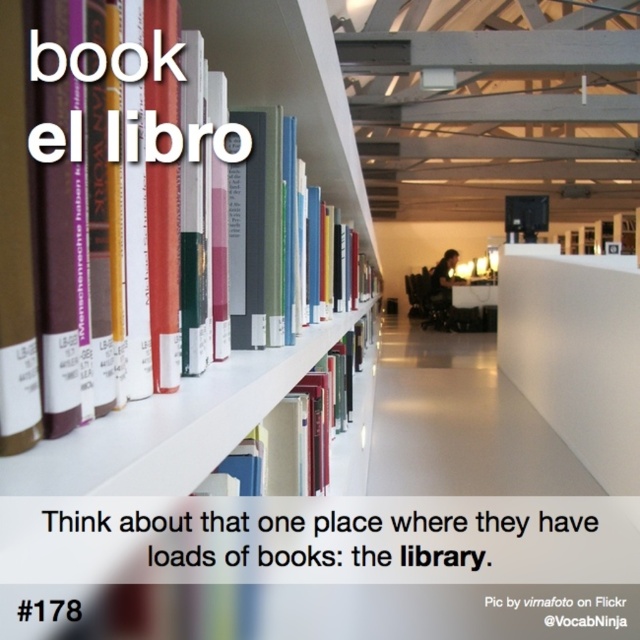
You are organizing books in a library and need to place two books on a shelf. You have the hardcover books at left and the hardcover book at center. According to their positions in the image, which one should be placed to the right of the other to maintain the same arrangement?

The hardcover books at left should be placed to the right of the hardcover book at center to maintain the same arrangement, as in the image the hardcover books at left is positioned on the right side of hardcover book at center.

You are a librarian who needs to reach the hardcover books at left to reshelve a book. If your arm can extend 50 centimeters, can you reach them without moving your position?

The hardcover books at left are 60.43 centimeters away from you. Since your arm can only extend 50 centimeters, you cannot reach them without moving your position.

You are a librarian organizing books in a modern library. You need to place a new book on the shelf. The existing hardcover books at left are located at point 0.134, 0.455. Where should you place the new book to maintain the existing arrangement?

The new book should be placed near the existing hardcover books at left at point (291, 84) to maintain the arrangement.